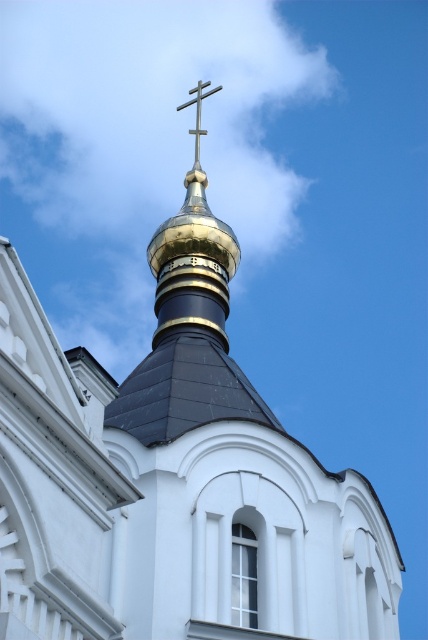
Is point (223, 244) more distant than point (195, 134)?

No.

Between gold polished dome at upper center and gold metallic cross at upper center, which one is positioned lower?

gold polished dome at upper center is lower down.

Where is `gold polished dome at upper center`? gold polished dome at upper center is located at coordinates (193, 248).